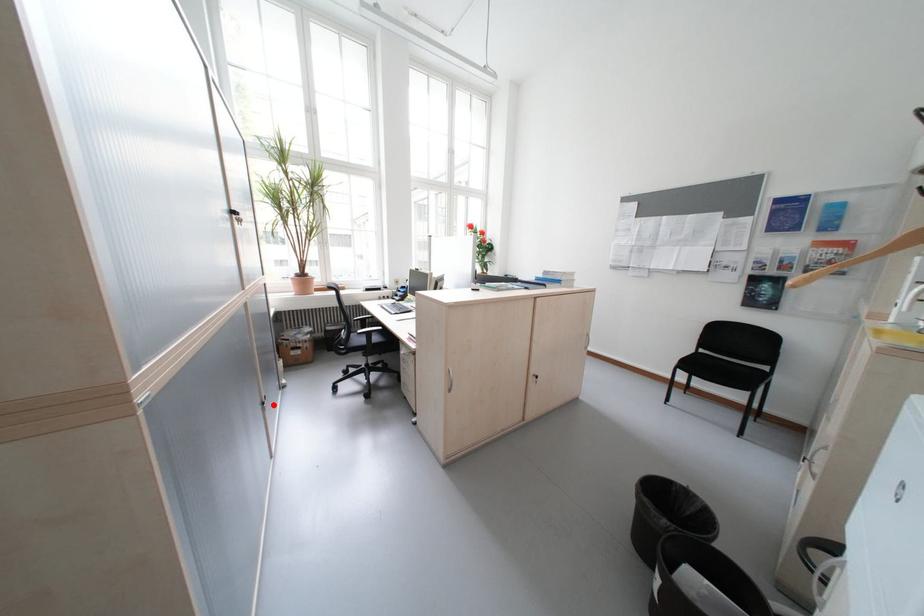
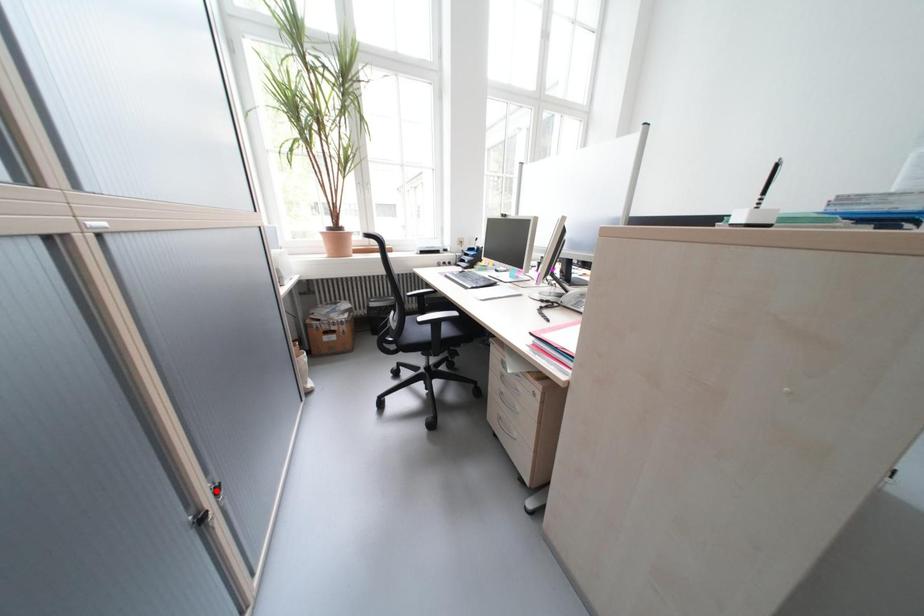
I am providing you with two images of the same scene from different viewpoints. A red point is marked on the first image and another point is marked on the second image. Does the point marked in image1 correspond to the same location as the one in image2?

No